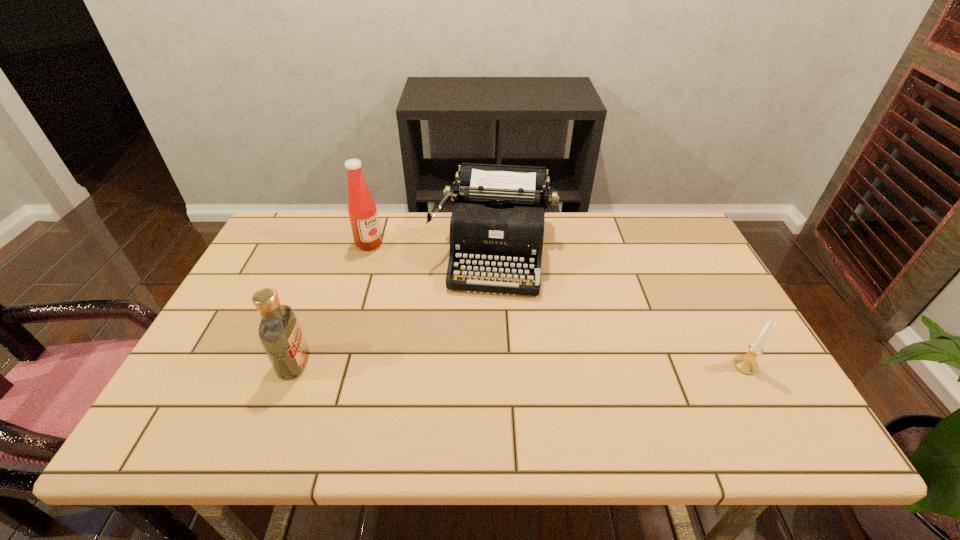
You are a GUI agent. You are given a task and a screenshot of the screen. Output one action in this format:
    pyautogui.click(x=<x>, y=<y>)
    Task: Click on the free spot on the desktop that is between the leftmost object and the shortest object and is positioned on the typing side of the typewriter
    This screenshot has width=960, height=540.
    Given the screenshot: What is the action you would take?
    pyautogui.click(x=479, y=364)

You are a GUI agent. You are given a task and a screenshot of the screen. Output one action in this format:
    pyautogui.click(x=<x>, y=<y>)
    Task: Click on the free space on the desktop that is between the leftmost object and the rightmost object and is positioned on the front-facing side of the tallest object
    
    Given the screenshot: What is the action you would take?
    pyautogui.click(x=521, y=364)